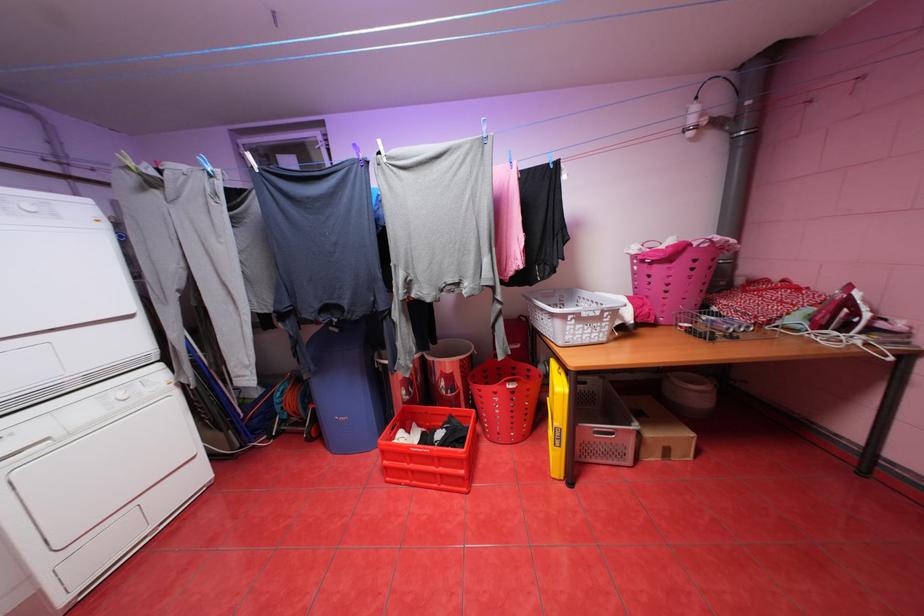
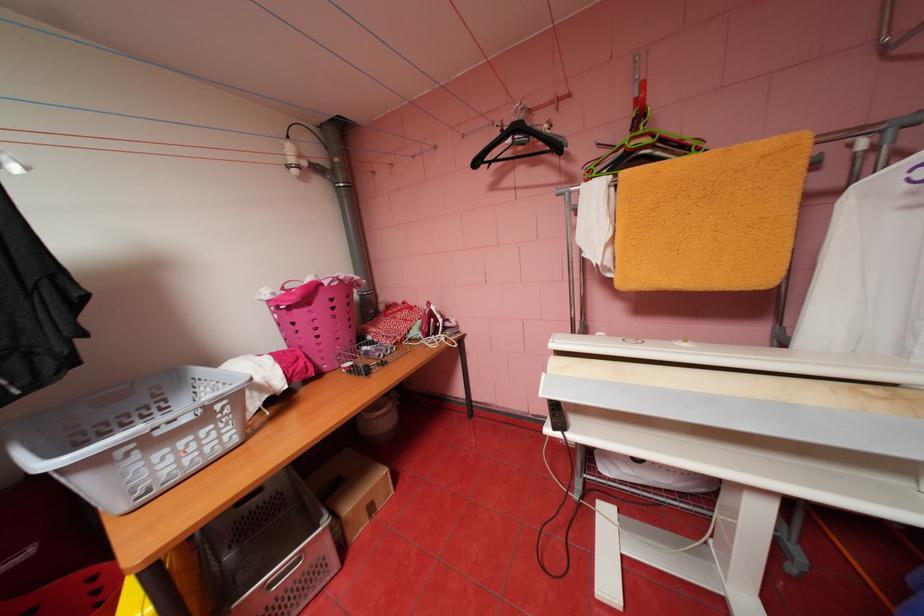
Locate, in the second image, the point that corresponds to pixel 844 334 in the first image.

(442, 337)